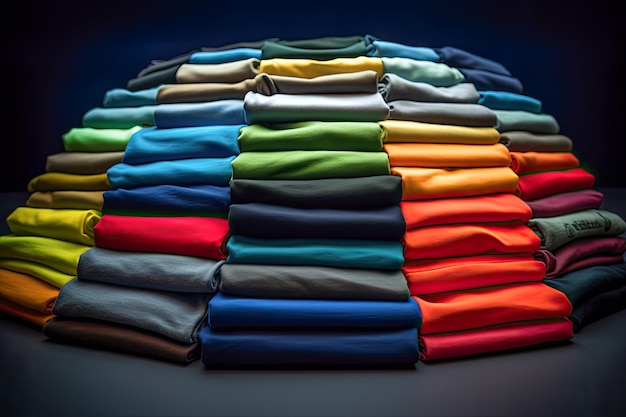
I want to click on grey and black fabrics, so point(166,316), point(170,277), point(243,282), point(282,195), point(520,134), point(156,80), point(165,63), point(249,44).